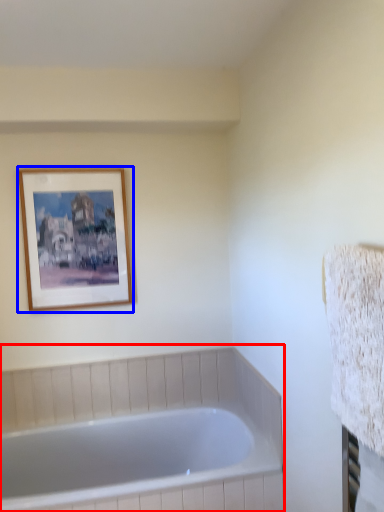
Question: Which object appears farthest to the camera in this image, bathtub (highlighted by a red box) or picture frame (highlighted by a blue box)?

Choices:
 (A) bathtub
 (B) picture frame

Answer: (B)